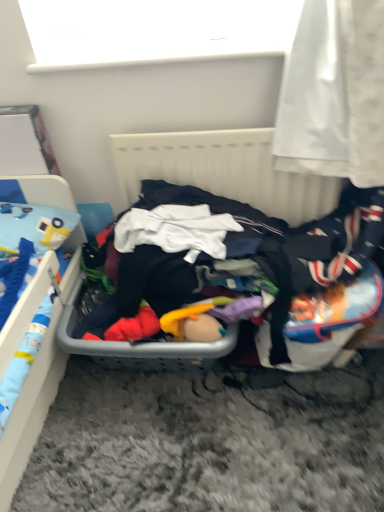
Question: Should I look upward or downward to see white matte window screen at upper center?

Choices:
 (A) down
 (B) up

Answer: (B)

Question: Can dark fabric clothes at center be found inside white plastic radiator at center?

Choices:
 (A) no
 (B) yes

Answer: (A)

Question: Is the position of white plastic radiator at center more distant than that of dark fabric clothes at center?

Choices:
 (A) no
 (B) yes

Answer: (B)

Question: Is white plastic radiator at center to the right of dark fabric clothes at center from the viewer's perspective?

Choices:
 (A) yes
 (B) no

Answer: (B)

Question: Does white plastic radiator at center turn towards dark fabric clothes at center?

Choices:
 (A) yes
 (B) no

Answer: (A)

Question: Considering the relative sizes of white plastic radiator at center and dark fabric clothes at center in the image provided, is white plastic radiator at center shorter than dark fabric clothes at center?

Choices:
 (A) yes
 (B) no

Answer: (B)

Question: From a real-world perspective, is white plastic radiator at center physically above dark fabric clothes at center?

Choices:
 (A) yes
 (B) no

Answer: (A)

Question: Is dark fabric clothes at center positioned with its back to white plastic radiator at center?

Choices:
 (A) yes
 (B) no

Answer: (A)

Question: Does dark fabric clothes at center have a lesser height compared to white plastic radiator at center?

Choices:
 (A) no
 (B) yes

Answer: (B)

Question: Does dark fabric clothes at center come behind white plastic radiator at center?

Choices:
 (A) no
 (B) yes

Answer: (A)

Question: From a real-world perspective, does dark fabric clothes at center sit lower than white plastic radiator at center?

Choices:
 (A) no
 (B) yes

Answer: (B)

Question: Is dark fabric clothes at center not inside white plastic radiator at center?

Choices:
 (A) no
 (B) yes

Answer: (B)

Question: From the image's perspective, is dark fabric clothes at center on white plastic radiator at center?

Choices:
 (A) no
 (B) yes

Answer: (A)

Question: Is dark fabric clothes at center at the left side of blue plastic bed at left?

Choices:
 (A) no
 (B) yes

Answer: (A)